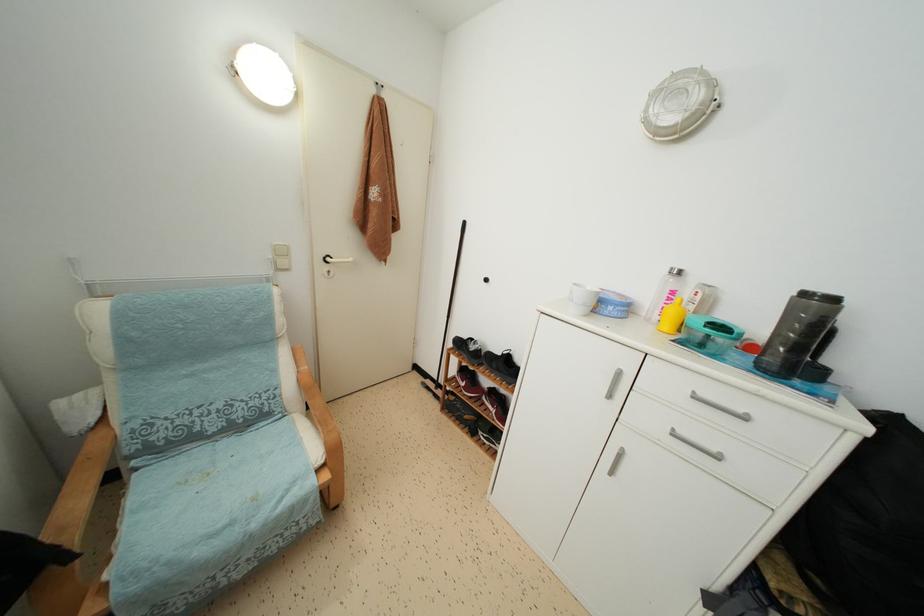
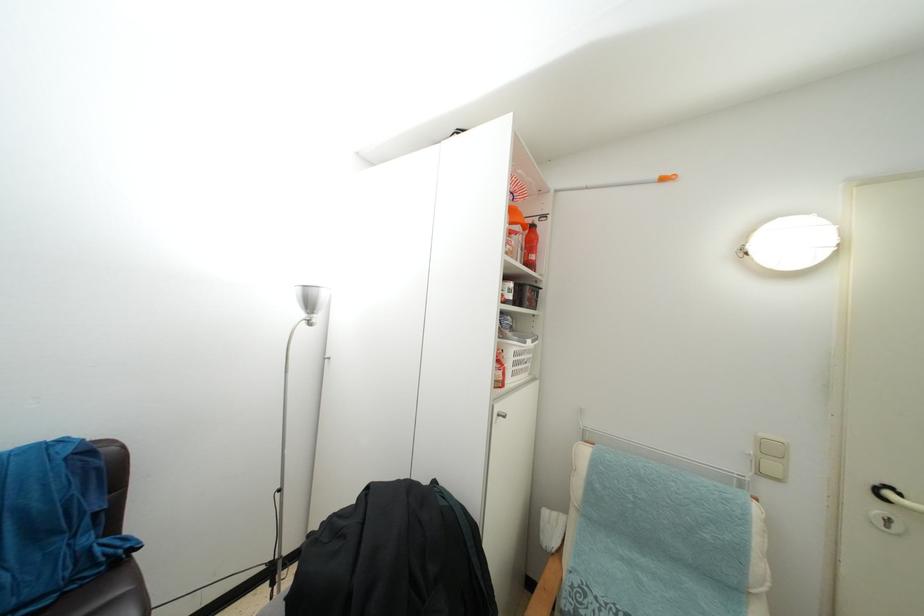
Find the pixel in the second image that matches (333,265) in the first image.

(893, 500)